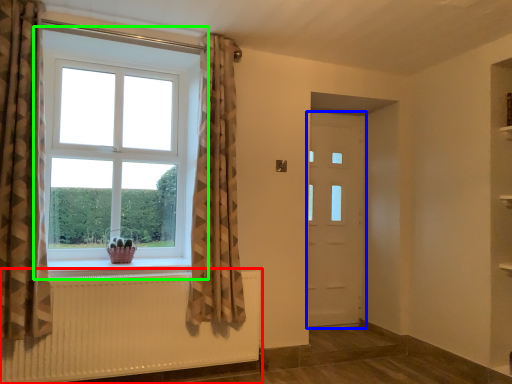
Question: Estimate the real-world distances between objects in this image. Which object is farther from radiator (highlighted by a red box), door (highlighted by a blue box) or window (highlighted by a green box)?

Choices:
 (A) door
 (B) window

Answer: (A)